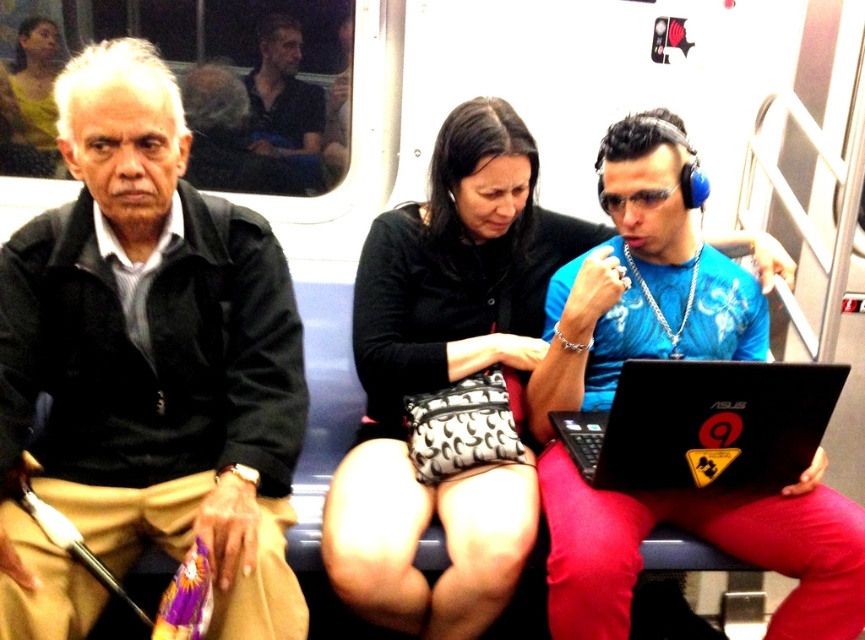
You are a passenger on the subway and you have a black matte laptop at center and a matte yellow shirt at upper left in your view. Which object is closer to you?

The black matte laptop at center is closer to you because it is in front of the matte yellow shirt at upper left.

You are a passenger on the subway and want to know if the point at coordinate (693, 268) is closer to you than the point at (774, 444). Can you determine this based on the scene?

Point (693, 268) is further to the camera than point (774, 444), so the point at (774, 444) is closer to you.

You are a photographer trying to capture a candid shot of the woman with the black fabric purse at center without her noticing. You have a camera that has a minimum focusing distance of 1.5 meters. Can you take the photo from where you are standing?

The black fabric purse at center and camera are 1.51 meters apart from each other. Since the minimum focusing distance is 1.5 meters, the photographer can take the photo as the distance is just beyond the required minimum.